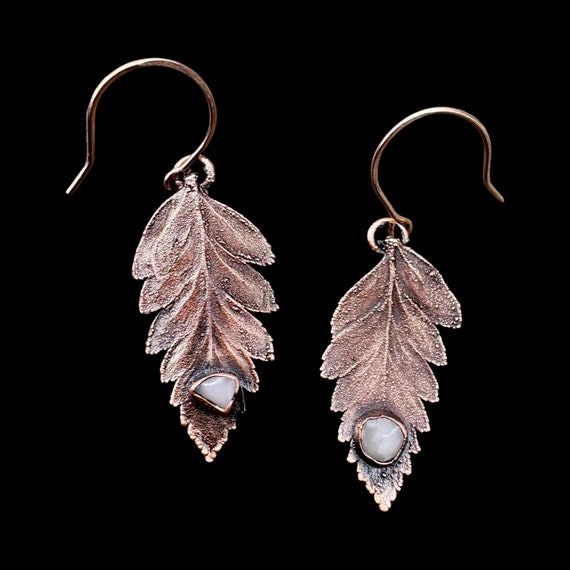
I want to click on hook, so click(x=492, y=187).